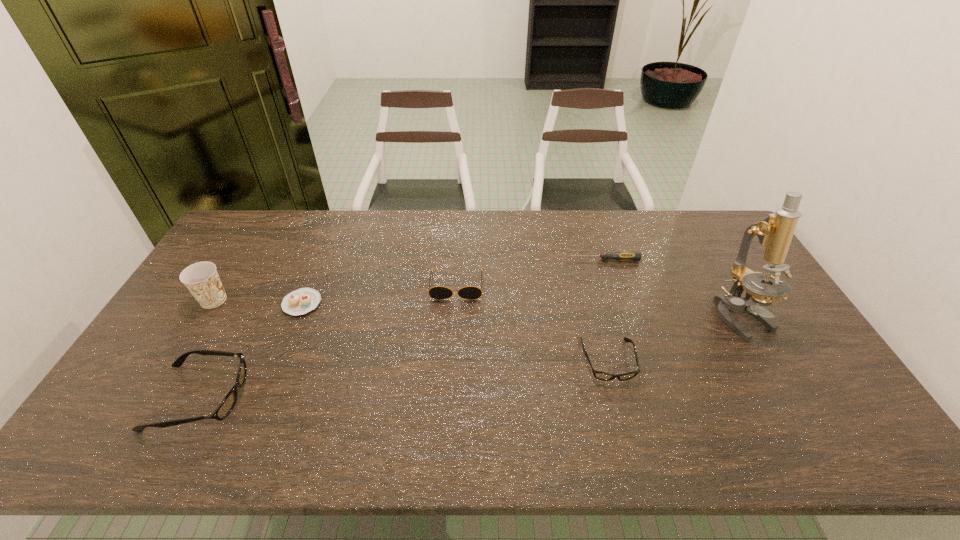
Where is `vacant area between the cupcake and the right spectacles`? vacant area between the cupcake and the right spectacles is located at coordinates (455, 332).

This screenshot has width=960, height=540. Identify the location of free area in between the Dixie cup and the sunglasses. (335, 293).

Find the location of a particular element. The height and width of the screenshot is (540, 960). vacant point located between the sunglasses and the second tallest object is located at coordinates (335, 293).

At what (x,y) coordinates should I click in order to perform the action: click on free area in between the farthest object and the cupcake. Please return your answer as a coordinate pair (x, y). The height and width of the screenshot is (540, 960). Looking at the image, I should click on (453, 281).

The height and width of the screenshot is (540, 960). Identify the location of vacant area that lies between the fourth object from left to right and the right spectacles. (532, 323).

Find the location of a particular element. The image size is (960, 540). free space between the screwdriver and the cupcake is located at coordinates (453, 281).

Find the location of a particular element. This screenshot has height=540, width=960. empty location between the taller spectacles and the right spectacles is located at coordinates (404, 379).

Identify which object is located as the fifth nearest to the left spectacles. Please provide its 2D coordinates. Your answer should be formatted as a tuple, i.e. [(x, y)], where the tuple contains the x and y coordinates of a point satisfying the conditions above.

[(620, 255)]

You are a GUI agent. You are given a task and a screenshot of the screen. Output one action in this format:
    pyautogui.click(x=<x>, y=<y>)
    Task: Click on the object identified as the second closest to the taller spectacles
    The width and height of the screenshot is (960, 540).
    Given the screenshot: What is the action you would take?
    pyautogui.click(x=201, y=279)

The height and width of the screenshot is (540, 960). I want to click on vacant space that satisfies the following two spatial constraints: 1. on the front side of the tallest object; 2. on the left side of the Dixie cup, so click(204, 316).